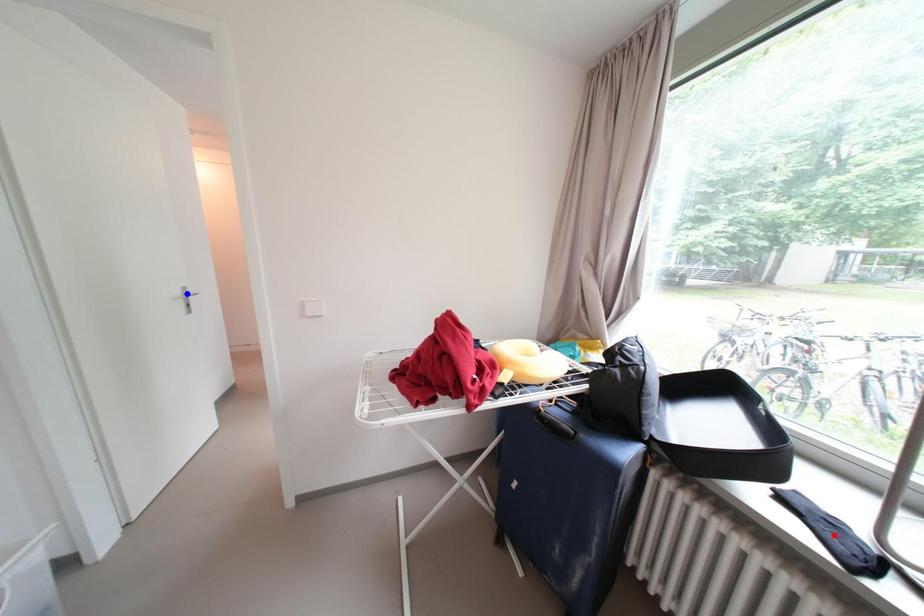
Question: In the image, two points are highlighted. Which point is nearer to the camera? Reply with the corresponding letter.

Choices:
 (A) blue point
 (B) red point

Answer: (B)